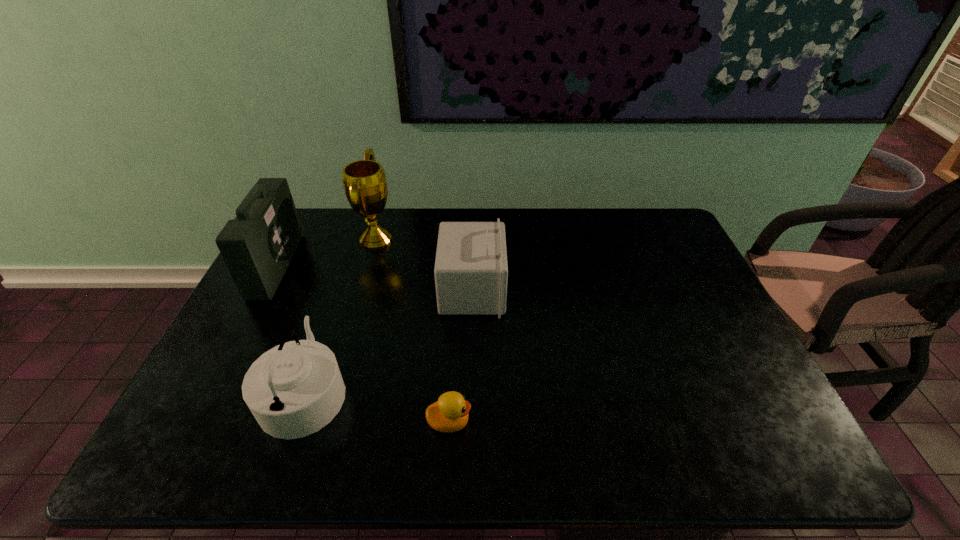
Image resolution: width=960 pixels, height=540 pixels. In order to click on vacant point located between the second shortest object and the shortest object in this screenshot , I will do `click(377, 407)`.

Where is `free space between the award and the second shortest object`? The width and height of the screenshot is (960, 540). free space between the award and the second shortest object is located at coordinates coord(341,315).

Locate an element on the screen. empty space that is in between the taller first-aid kit and the right first-aid kit is located at coordinates click(374, 278).

This screenshot has height=540, width=960. Find the location of `free spot between the right first-aid kit and the award`. free spot between the right first-aid kit and the award is located at coordinates (424, 265).

Select which object appears as the second closest to the right first-aid kit. Please provide its 2D coordinates. Your answer should be formatted as a tuple, i.e. [(x, y)], where the tuple contains the x and y coordinates of a point satisfying the conditions above.

[(293, 390)]

Point out which object is positioned as the second nearest to the award. Please provide its 2D coordinates. Your answer should be formatted as a tuple, i.e. [(x, y)], where the tuple contains the x and y coordinates of a point satisfying the conditions above.

[(257, 246)]